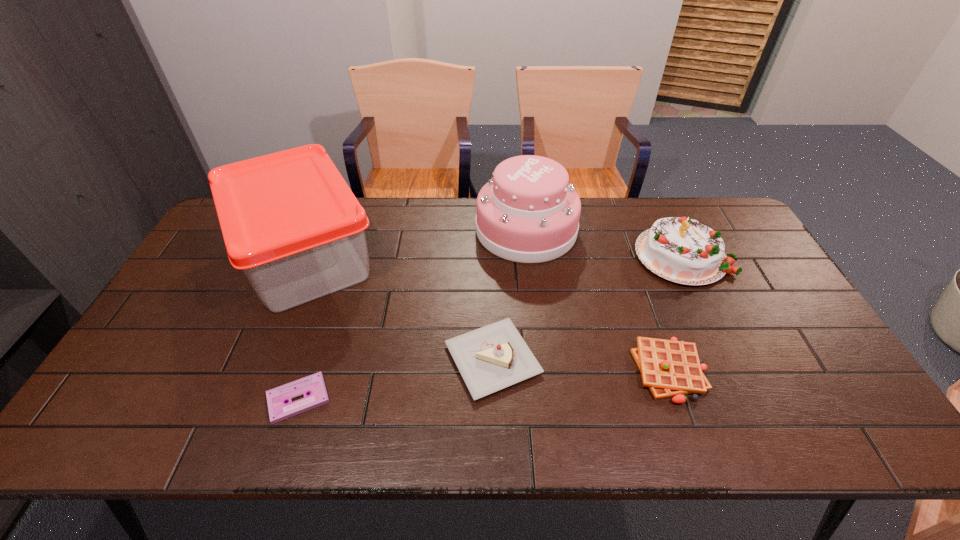
This screenshot has height=540, width=960. I want to click on tray, so click(x=290, y=222).

You are a GUI agent. You are given a task and a screenshot of the screen. Output one action in this format:
    pyautogui.click(x=<x>, y=<y>)
    Task: Click on the tallest cake
    The image size is (960, 540).
    Given the screenshot: What is the action you would take?
    pyautogui.click(x=528, y=212)

Where is `the fourth shortest object`? The width and height of the screenshot is (960, 540). the fourth shortest object is located at coordinates (683, 250).

This screenshot has width=960, height=540. Find the location of `the rightmost cake`. the rightmost cake is located at coordinates (683, 250).

Identify the location of the nearest cake. Image resolution: width=960 pixels, height=540 pixels. (491, 358).

Image resolution: width=960 pixels, height=540 pixels. In order to click on the third shortest object in this screenshot , I will do `click(491, 358)`.

What are the coordinates of `the fifth tallest object` in the screenshot? It's located at pyautogui.click(x=669, y=368).

The image size is (960, 540). What are the coordinates of `videotape` in the screenshot? It's located at (279, 410).

In order to click on free spot located 0.200m on the right of the tray in this screenshot , I will do `click(450, 256)`.

Locate an element on the screen. free space located 0.060m on the right of the tallest cake is located at coordinates (594, 230).